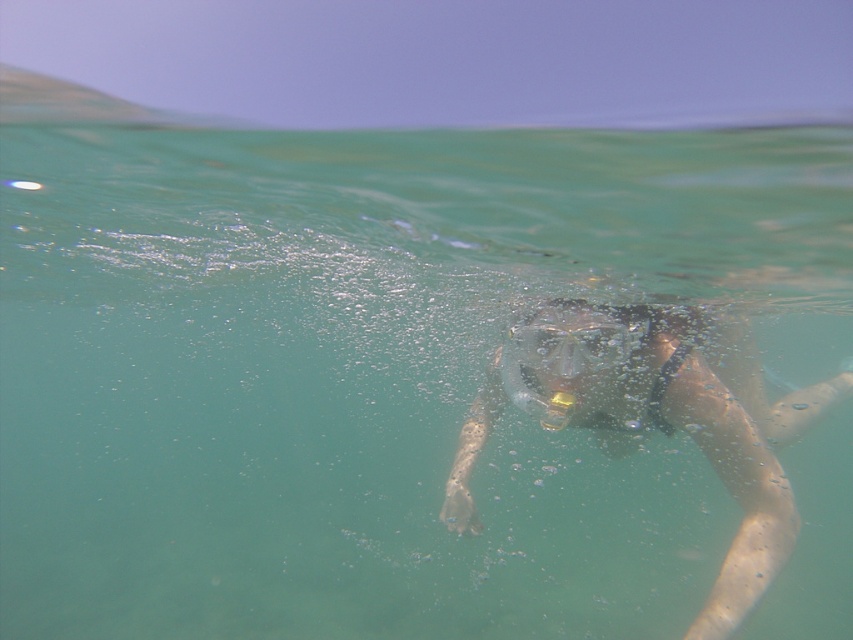
Question: Among these objects, which one is farthest from the camera?

Choices:
 (A) transparent plastic goggles at center
 (B) transparent plastic snorkel mask at center

Answer: (A)

Question: Is transparent plastic snorkel mask at center to the left of transparent plastic goggles at center from the viewer's perspective?

Choices:
 (A) no
 (B) yes

Answer: (A)

Question: Does transparent plastic snorkel mask at center have a larger size compared to transparent plastic goggles at center?

Choices:
 (A) yes
 (B) no

Answer: (A)

Question: Is transparent plastic snorkel mask at center smaller than transparent plastic goggles at center?

Choices:
 (A) yes
 (B) no

Answer: (B)

Question: Which object is farther from the camera taking this photo?

Choices:
 (A) transparent plastic snorkel mask at center
 (B) transparent plastic goggles at center

Answer: (B)